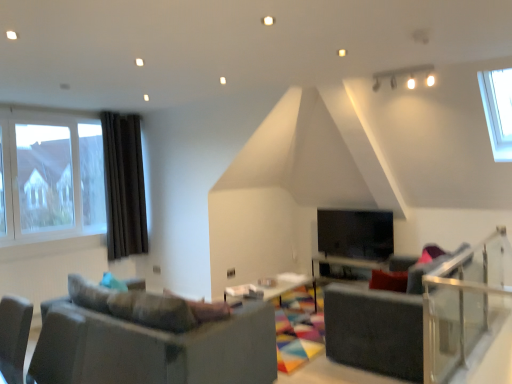
Question: Is dark gray fabric armchair at center wider or thinner than wooden table at center, the second table in the left-to-right sequence?

Choices:
 (A) wide
 (B) thin

Answer: (A)

Question: From a real-world perspective, relative to wooden table at center, the second table in the left-to-right sequence, is dark gray fabric armchair at center vertically above or below?

Choices:
 (A) above
 (B) below

Answer: (A)

Question: Which object is positioned farthest from the dark gray fabric armchair at center?

Choices:
 (A) wooden table at center, the second table viewed from the right
 (B) clear glass balustrade at right
 (C) black glass fireplace at center
 (D) matte gray couch at lower left
 (E) dark brown fabric curtain at left

Answer: (E)

Question: Which object is the farthest from the matte gray couch at lower left?

Choices:
 (A) clear glass window at left
 (B) clear glass balustrade at right
 (C) dark brown fabric curtain at left
 (D) black glass fireplace at center
 (E) wooden table at center, the second table in the left-to-right sequence

Answer: (C)